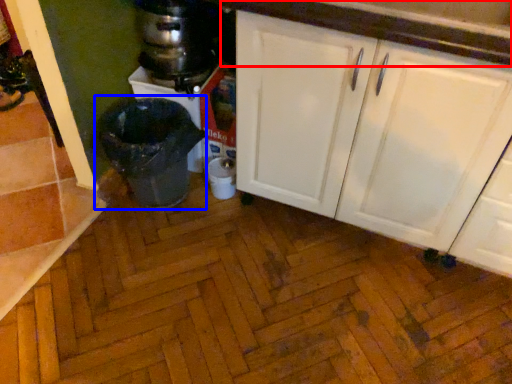
Question: Which object appears closest to the camera in this image, countertop (highlighted by a red box) or waste container (highlighted by a blue box)?

Choices:
 (A) countertop
 (B) waste container

Answer: (A)